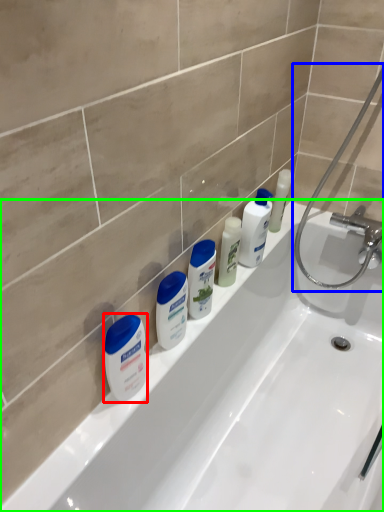
Question: Estimate the real-world distances between objects in this image. Which object is closer to cleaning product (highlighted by a red box), shower (highlighted by a blue box) or bathtub (highlighted by a green box)?

Choices:
 (A) shower
 (B) bathtub

Answer: (B)